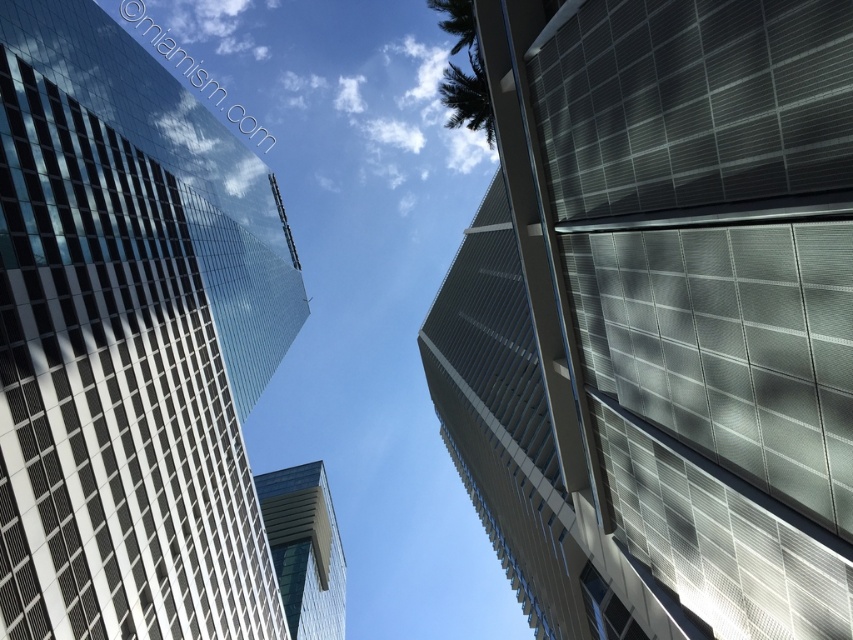
Looking at this image, you are standing at the base of the buildings and want to take a photo of the sleek metallic building at upper right. Based on its position, where should you aim your camera to capture it in the frame?

You should aim your camera at the point 0.497 on the horizontal axis and 0.775 on the vertical axis to capture the sleek metallic building at upper right in the frame.

In the scene shown: You are standing at the base of the two high rise buildings and want to take a photo of the point at coordinates point [527,360] and point [242,636]. Which point will appear closer to the camera in your photo?

A: Point [242,636] will appear closer to the camera in the photo because it is in front of point [527,360].

You are a drone operator trying to navigate between the two buildings. Given that your drone has a maximum width of 1 meter, can it safely pass through the narrowest point between the sleek metallic building at upper right and the transparent glass skyscraper at upper left?

The sleek metallic building at upper right is thinner than the transparent glass skyscraper at upper left, so the narrowest point between them is determined by the width of the sleek metallic building at upper right. Since the drone is 1 meter wide, it can safely pass through the narrowest point as long as the minimum width there is at least 1 meter. However, without exact measurements, we can only confirm that the path is narrower on the sleek metallic building at upper right side, so proceed with caution.